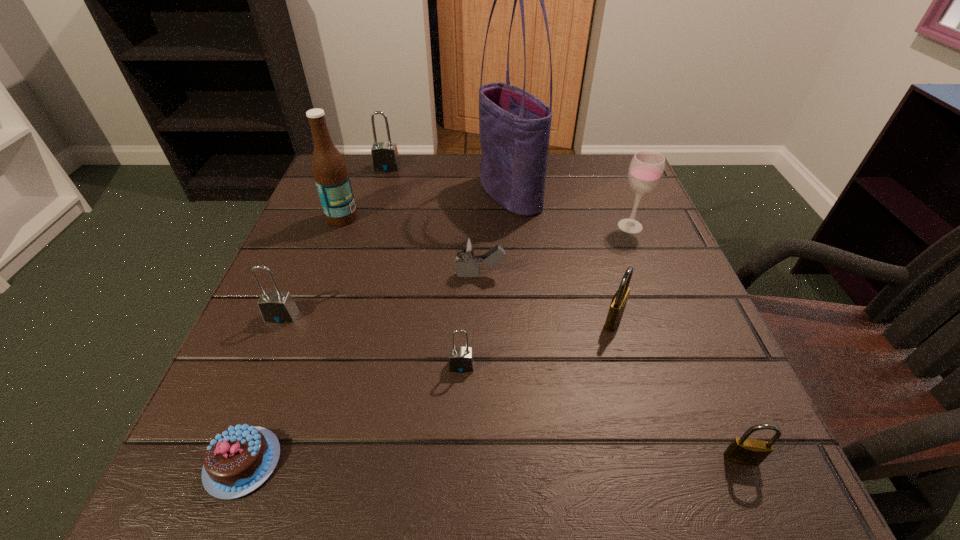
Locate an element on the screen. The height and width of the screenshot is (540, 960). padlock located in the near edge section of the desktop is located at coordinates (746, 451).

Find the location of a particular element. chocolate cake situated at the near edge is located at coordinates (237, 461).

Image resolution: width=960 pixels, height=540 pixels. Identify the location of beer bottle located at the left edge. (330, 172).

Find the location of a particular element. chocolate cake that is at the left edge is located at coordinates coord(237,461).

This screenshot has height=540, width=960. What are the coordinates of `wineglass present at the right edge` in the screenshot? It's located at (646, 169).

Where is `object that is at the far left corner`? The width and height of the screenshot is (960, 540). object that is at the far left corner is located at coordinates (385, 158).

In order to click on object that is at the near left corner in this screenshot , I will do `click(237, 461)`.

Locate an element on the screen. Image resolution: width=960 pixels, height=540 pixels. object that is at the near right corner is located at coordinates coord(746,451).

Locate an element on the screen. This screenshot has width=960, height=540. free space at the far edge is located at coordinates (546, 190).

This screenshot has height=540, width=960. What are the coordinates of `vacant space at the near edge of the desktop` in the screenshot? It's located at (459, 450).